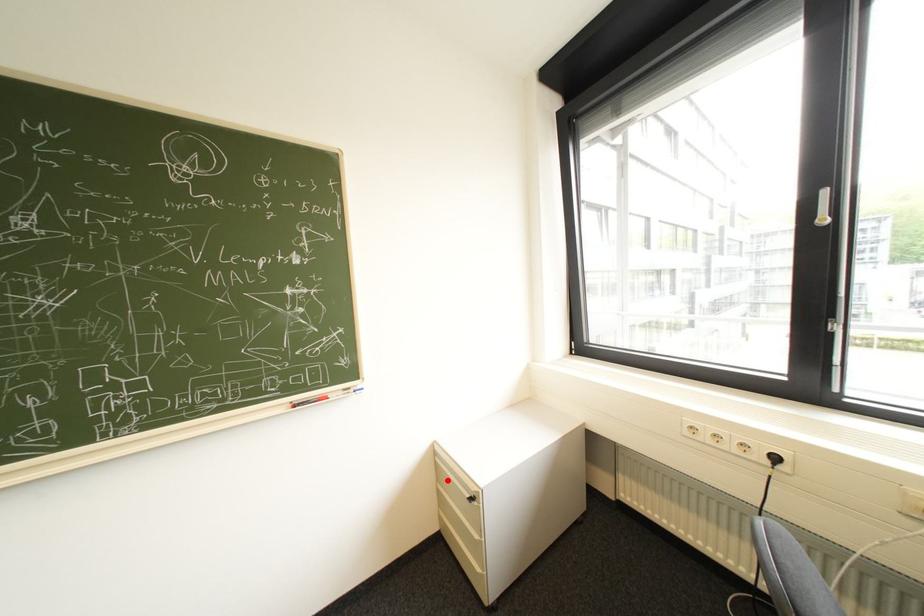
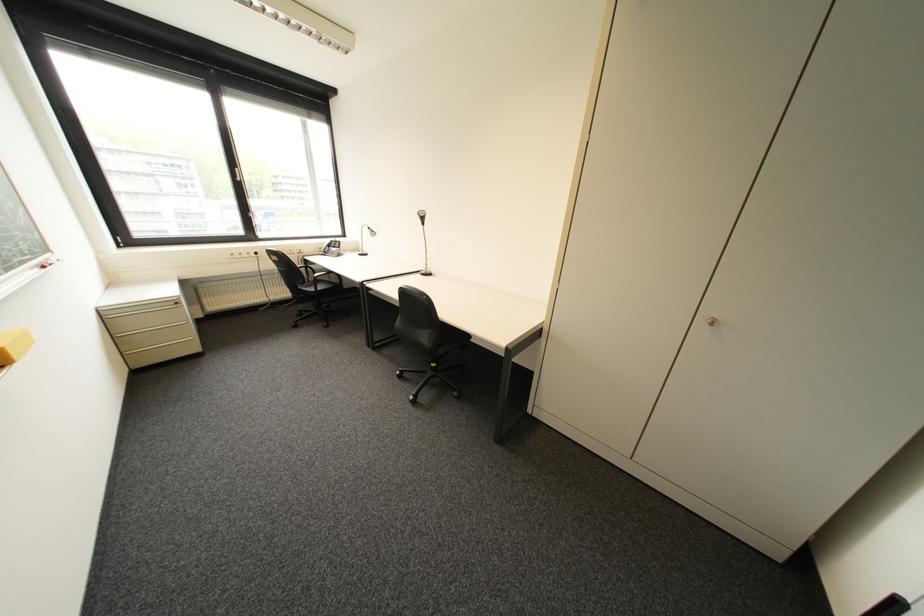
Locate, in the second image, the point that corresponds to the highlighted location in the first image.

(122, 336)